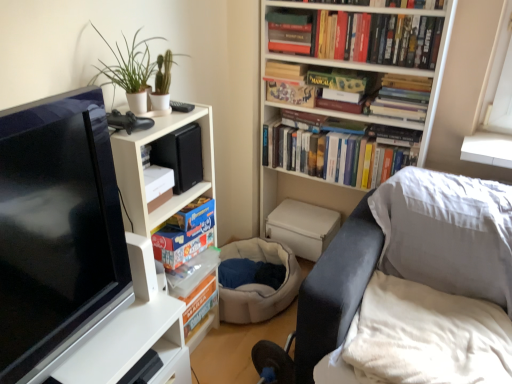
Identify the location of free space above hardcover book at upper center, acting as the 5th book starting from the bottom (from a real-world perspective). Image resolution: width=512 pixels, height=384 pixels. (382, 13).